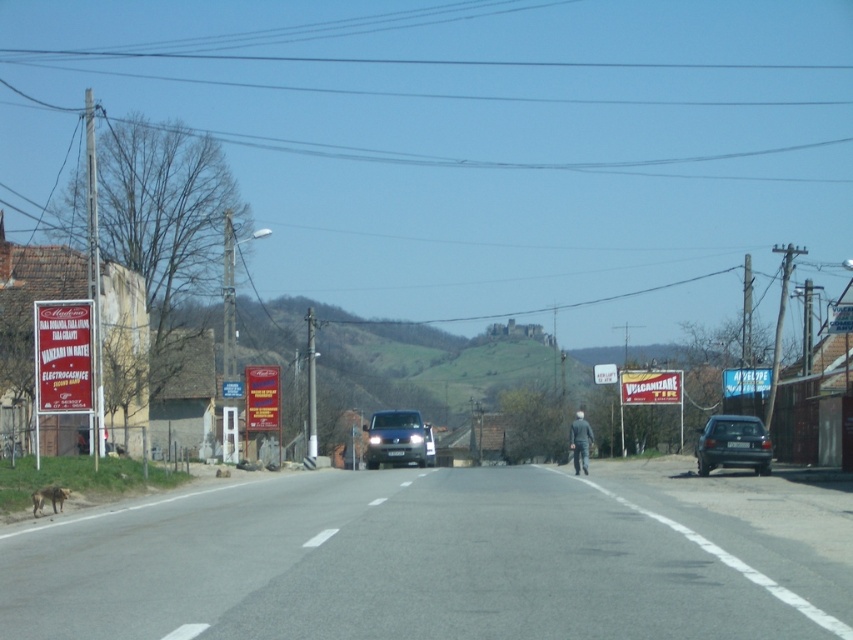
Question: Is dark gray fabric jacket at center bigger than brown fur dog at lower left?

Choices:
 (A) no
 (B) yes

Answer: (B)

Question: Which point is farther from the camera taking this photo?

Choices:
 (A) (749, 460)
 (B) (582, 436)
 (C) (62, 504)
 (D) (403, 456)

Answer: (D)

Question: Can you confirm if dark gray metallic car at right is positioned below dark gray fabric jacket at center?

Choices:
 (A) yes
 (B) no

Answer: (B)

Question: Which object is farther from the camera taking this photo?

Choices:
 (A) brown fur dog at lower left
 (B) satin black van at center
 (C) dark gray fabric jacket at center

Answer: (B)

Question: From the image, what is the correct spatial relationship of satin black van at center in relation to dark gray fabric jacket at center?

Choices:
 (A) above
 (B) below

Answer: (B)

Question: Which of the following is the closest to the observer?

Choices:
 (A) (56, 497)
 (B) (721, 458)

Answer: (A)